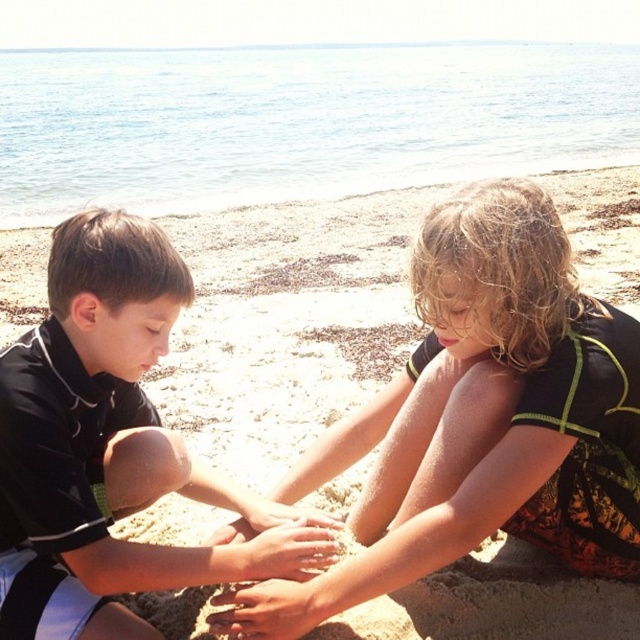
You are a lifeguard observing the scene. The black matte shirt at center belongs to the boy, and the smooth sand hands at center belong to the girl. Since the shirt is above the hands, does this indicate the boy is standing over the girl?

The black matte shirt at center is located above smooth sand hands at center, which suggests the boy is positioned above the girl, possibly standing over her.

You are a photographer trying to capture a closeup of the dark brown curly hair at center and the black matte shirt at center. Based on their sizes, which object should you focus on first to ensure it fits entirely within the camera frame?

The dark brown curly hair at center is bigger than the black matte shirt at center, so you should focus on the dark brown curly hair at center first to ensure it fits entirely within the camera frame.

From the picture: You are a drone operator trying to locate a specific point on the beach. The coordinates given are point (112, 448). According to the scene, where is this point located?

Point (112, 448) is on the black matte shirt at center.